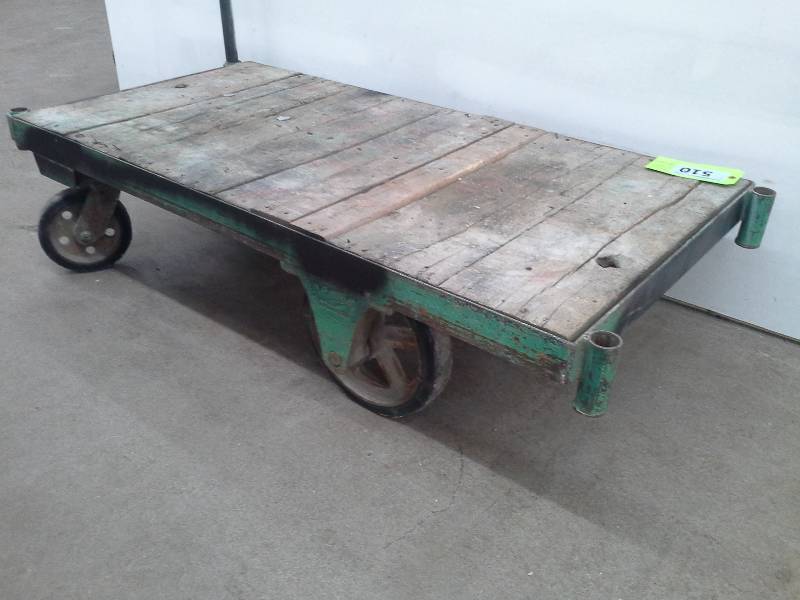
Where is `space between wall and floor`? space between wall and floor is located at coordinates (677, 301), (733, 322), (790, 339).